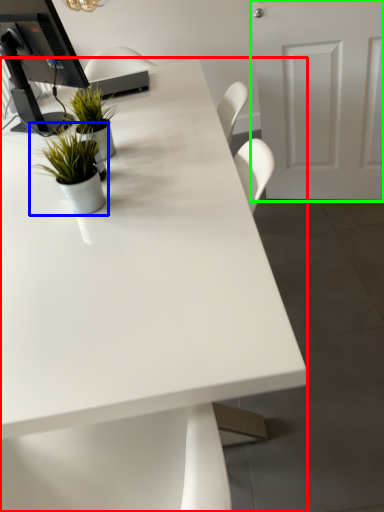
Question: Which object is positioned farthest from desk (highlighted by a red box)? Select from houseplant (highlighted by a blue box) and door (highlighted by a green box).

Choices:
 (A) houseplant
 (B) door

Answer: (B)